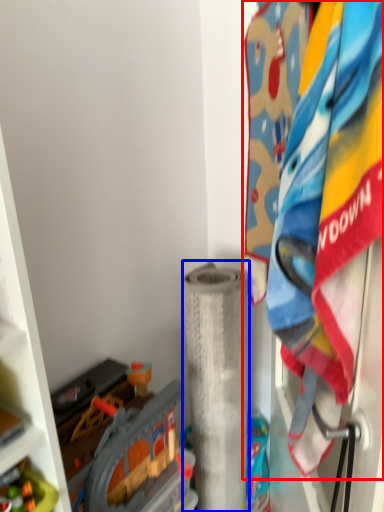
Question: Which point is further to the camera, laundry (highlighted by a red box) or toilet paper (highlighted by a blue box)?

Choices:
 (A) laundry
 (B) toilet paper

Answer: (B)